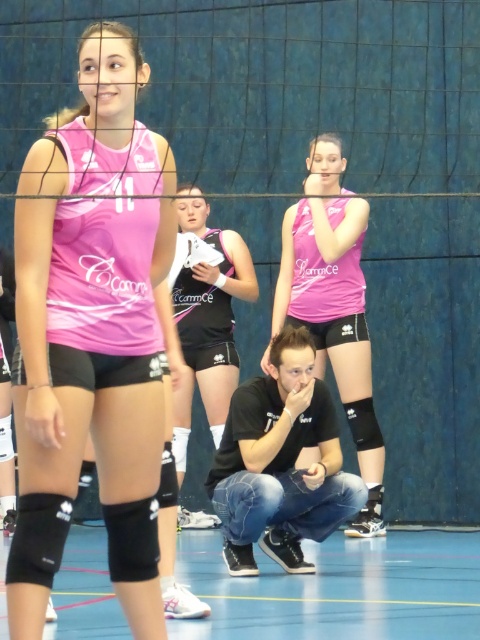
You are a photographer standing in the gymnasium and want to take a picture of the black denim jeans at center and the pink matte jersey at center. Which one will be visible in the foreground of the photo?

The black denim jeans at center is below the pink matte jersey at center, so the pink matte jersey at center will be in the foreground of the photo.

You are a volleyball coach observing the training session. You notice two players at the center of the court wearing black denim jeans and black matte shorts. The distance between them is crucial for a drill you want to set up. Can you confirm if the distance between the black denim jeans at center and the black matte shorts at center is sufficient for a 6 feet apart drill requirement?

The black denim jeans at center is 5.77 feet from the black matte shorts at center. Since 5.77 feet is less than 6 feet, the distance between them is insufficient for the 6 feet apart drill requirement.